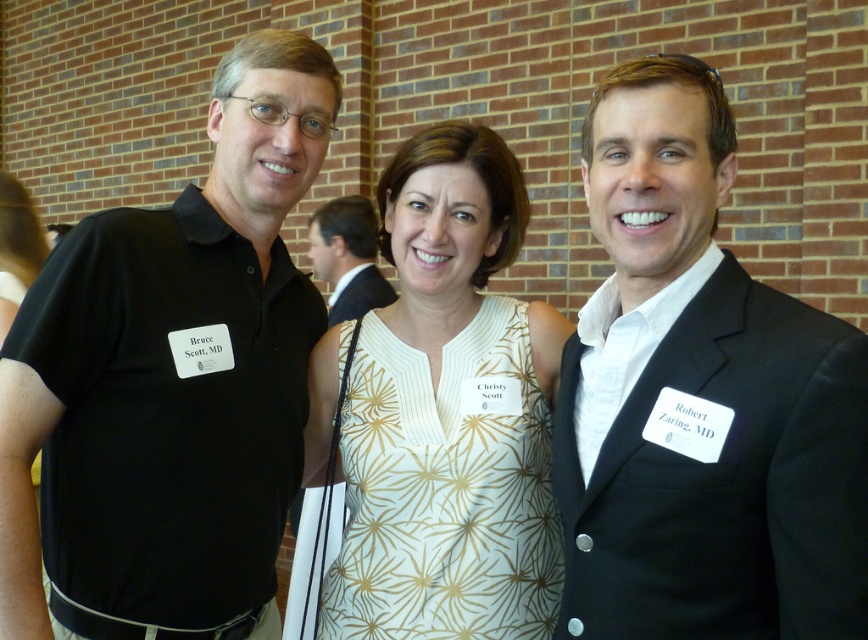
Question: Does white textured dress at center lie behind matte black shirt at center?

Choices:
 (A) yes
 (B) no

Answer: (B)

Question: Which object is positioned farthest from the black suit at right?

Choices:
 (A) white textured dress at center
 (B) matte black shirt at center

Answer: (B)

Question: Among these objects, which one is nearest to the camera?

Choices:
 (A) black matte shirt at left
 (B) matte black shirt at center

Answer: (A)

Question: Can you confirm if black suit at right is positioned to the right of matte black shirt at center?

Choices:
 (A) no
 (B) yes

Answer: (B)

Question: Is white textured dress at center wider than matte black shirt at center?

Choices:
 (A) yes
 (B) no

Answer: (A)

Question: Which object appears farthest from the camera in this image?

Choices:
 (A) black matte shirt at left
 (B) matte black shirt at center
 (C) black suit at right

Answer: (B)